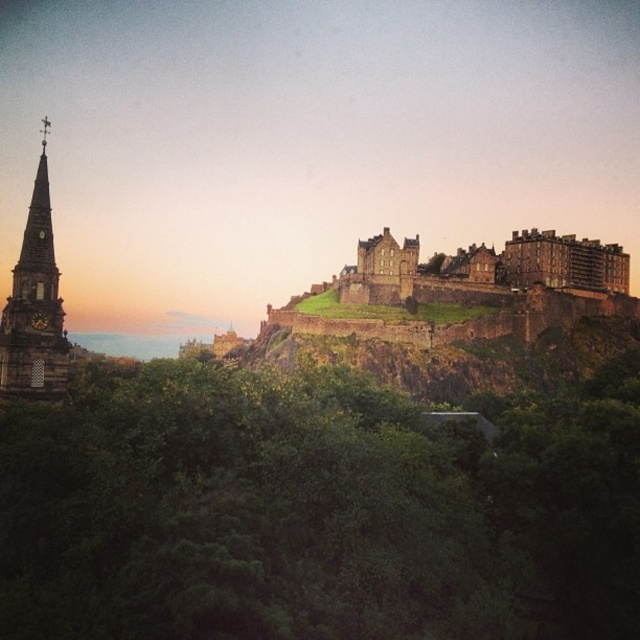
You are standing in the garden area of Edinburgh Castle and notice the green leafy tree at center and the dark brown stone steeple at left. Which object is taller?

The dark brown stone steeple at left is taller than the green leafy tree at center.

You are a tourist standing in front of Edinburgh Castle and notice the green leafy tree at center and the dark brown stone steeple at left. Which object would appear larger in your view?

The green leafy tree at center appears larger because it is closer to the viewer than the dark brown stone steeple at left.